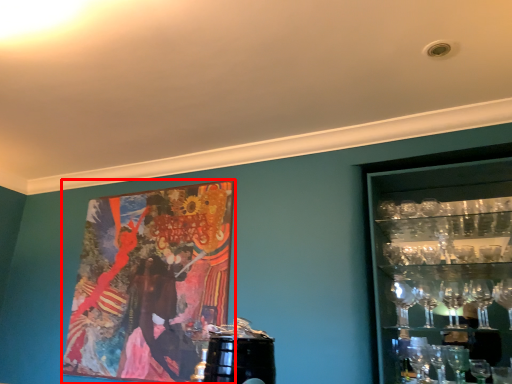
Question: From the image's perspective, what is the correct spatial relationship of picture frame (annotated by the red box) in relation to shelf?

Choices:
 (A) above
 (B) below

Answer: (B)